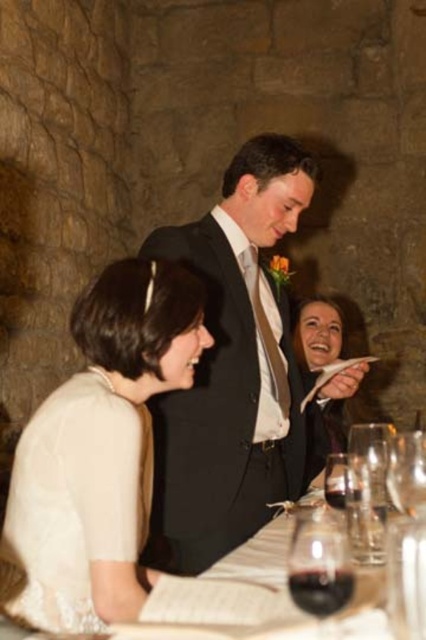
You are a photographer at the event and want to capture a shot of the black satin suit at center and the translucent glass wine at lower center without any obstructions. Based on their positions, which object should you focus on first to ensure both are in frame?

The black satin suit at center is to the left of the translucent glass wine at lower center, so you should focus on the black satin suit at center first to ensure both are in frame.